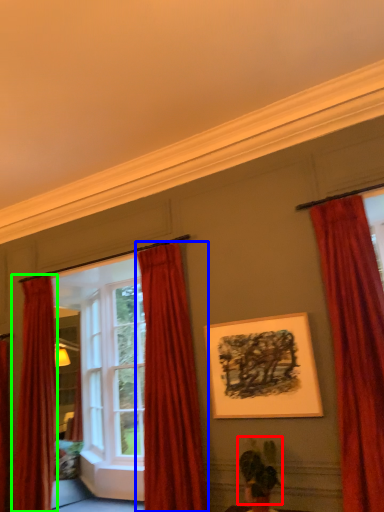
Question: Which object is the closest to the plant (highlighted by a red box)? Choose among these: curtain (highlighted by a blue box) or curtain (highlighted by a green box).

Choices:
 (A) curtain
 (B) curtain

Answer: (A)